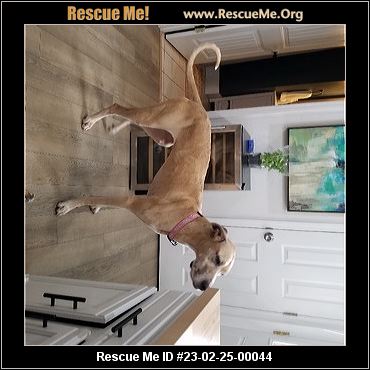
Find the location of a particular element. The image size is (370, 370). wooden floor is located at coordinates (139, 57), (58, 52), (63, 156), (116, 165), (71, 258), (142, 261).